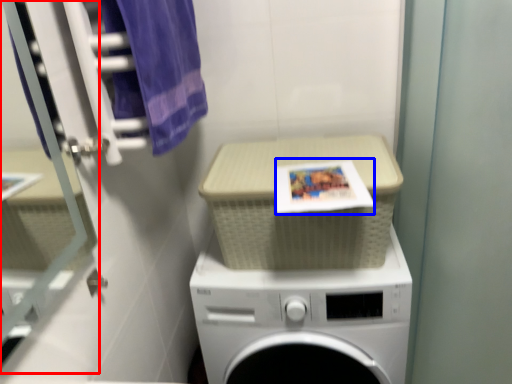
Question: Among these objects, which one is nearest to the camera, glass door (highlighted by a red box) or book cover (highlighted by a blue box)?

Choices:
 (A) glass door
 (B) book cover

Answer: (A)